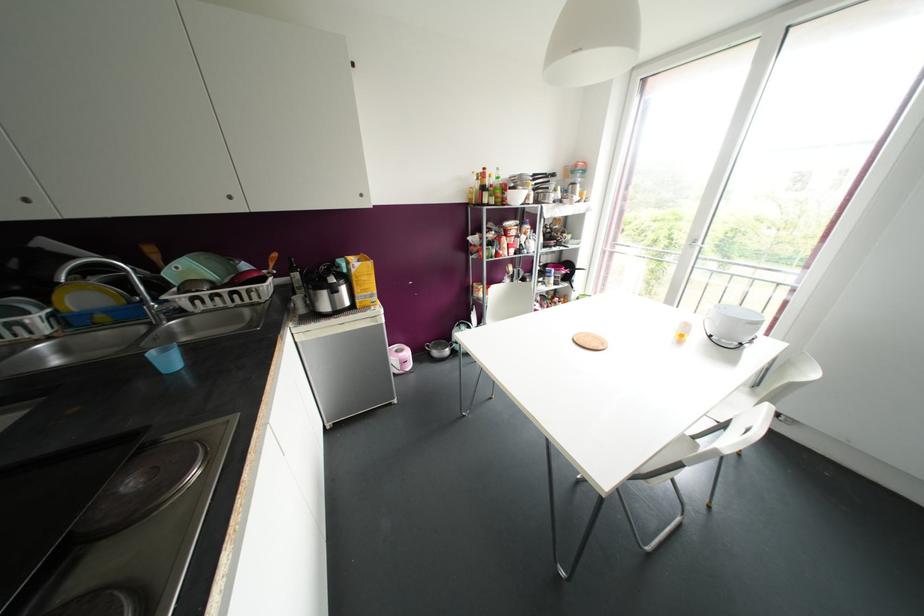
Locate an element on the screen. The width and height of the screenshot is (924, 616). metal faucet handle is located at coordinates (167, 310).